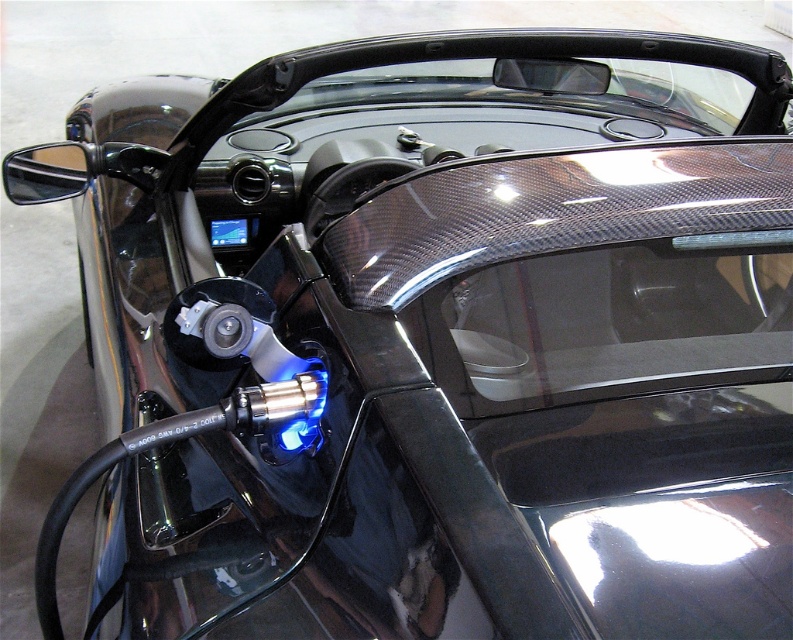
Question: From the image, what is the correct spatial relationship of transparent carbon fiber windshield at center in relation to transparent carbon fiber windshield at upper center?

Choices:
 (A) below
 (B) above

Answer: (A)

Question: Which point is closer to the camera?

Choices:
 (A) transparent carbon fiber windshield at center
 (B) transparent carbon fiber windshield at upper center

Answer: (A)

Question: Is transparent carbon fiber windshield at center smaller than transparent carbon fiber windshield at upper center?

Choices:
 (A) no
 (B) yes

Answer: (B)

Question: Is transparent carbon fiber windshield at center above transparent carbon fiber windshield at upper center?

Choices:
 (A) no
 (B) yes

Answer: (A)